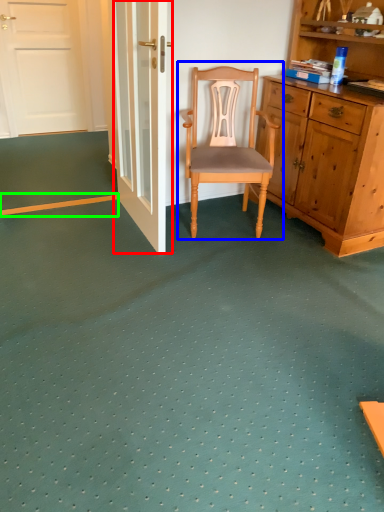
Question: Which is nearer to the door (highlighted by a red box)? chair (highlighted by a blue box) or strip (highlighted by a green box).

Choices:
 (A) chair
 (B) strip

Answer: (A)